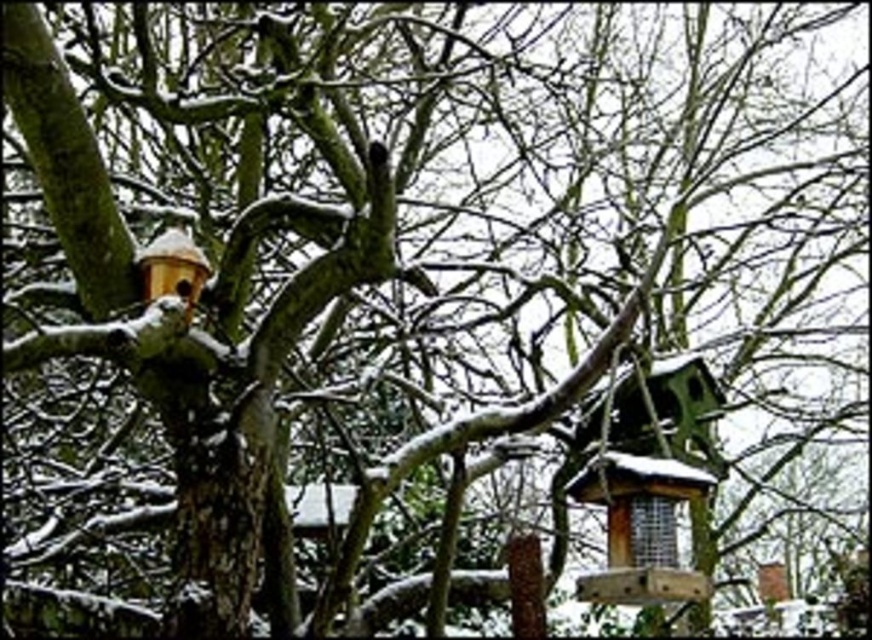
Based on the photo, you are a bird trying to land on the green wooden bird feeder at center and the wooden bird feeder at upper left. Which feeder has a larger surface area for you to land on?

The green wooden bird feeder at center might be wider than wooden bird feeder at upper left, so it likely has a larger surface area for landing.

In the scene shown: You are a bird flying towards the tree. You see the green wooden bird feeder at center and the wooden bird feeder at upper left. Which feeder do you need to fly higher to reach?

The green wooden bird feeder at center is much taller than the wooden bird feeder at upper left, so you need to fly higher to reach the green wooden bird feeder at center.

You are standing 10 feet away from the green wooden bird feeder at center. If you walk directly towards it, how many more feet do you need to walk to reach it?

The green wooden bird feeder at center is 15.63 feet from the camera. Since you are already 10 feet away from it, you need to walk an additional 5.63 feet to reach it.